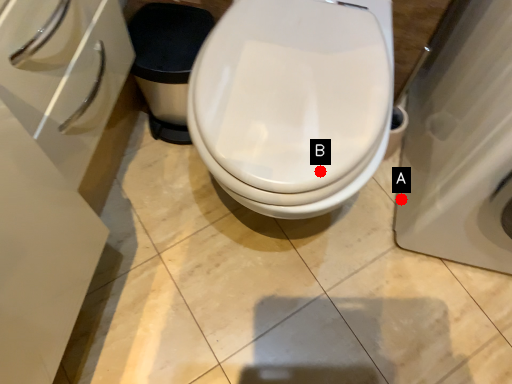
Question: Two points are circled on the image, labeled by A and B beside each circle. Which of the following is the closest to the observer?

Choices:
 (A) A is closer
 (B) B is closer

Answer: (B)